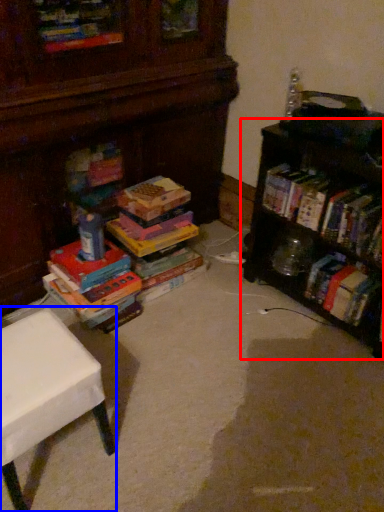
Question: Which point is closer to the camera, shelf (highlighted by a red box) or table (highlighted by a blue box)?

Choices:
 (A) shelf
 (B) table

Answer: (B)